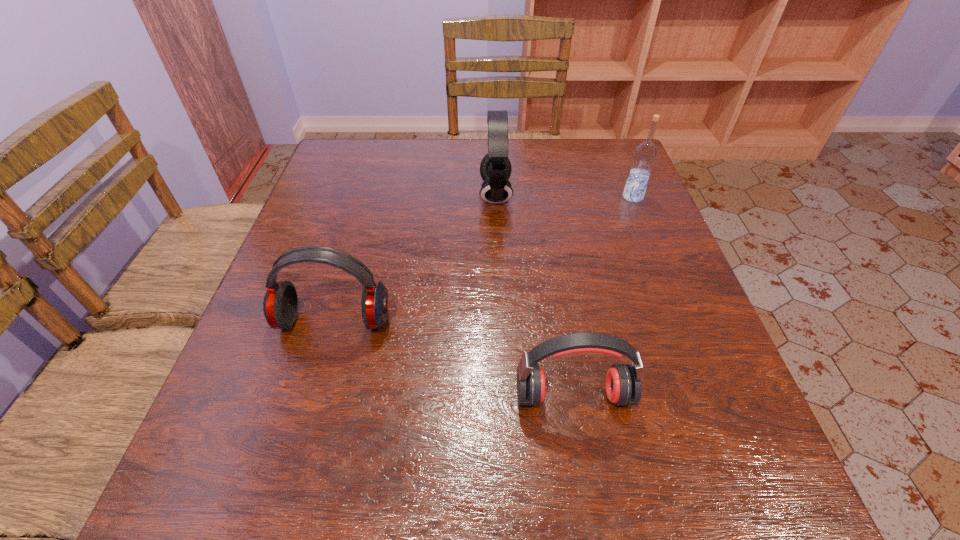
Locate an element on the screen. vacant region between the nearest object and the third farthest object is located at coordinates (454, 358).

This screenshot has width=960, height=540. In order to click on object that stands as the third closest to the tallest earphone in this screenshot , I will do `click(623, 382)`.

Identify which object is the nearest to the tallest earphone. Please provide its 2D coordinates. Your answer should be formatted as a tuple, i.e. [(x, y)], where the tuple contains the x and y coordinates of a point satisfying the conditions above.

[(645, 154)]

Where is `the closest earphone to the nearest object`? The width and height of the screenshot is (960, 540). the closest earphone to the nearest object is located at coordinates (280, 305).

Select which earphone appears as the third closest to the vodka. Please provide its 2D coordinates. Your answer should be formatted as a tuple, i.e. [(x, y)], where the tuple contains the x and y coordinates of a point satisfying the conditions above.

[(280, 305)]

Identify the location of vacant region that satisfies the following two spatial constraints: 1. on the ear cups of the tallest earphone; 2. on the ear cups of the leftmost earphone. click(x=501, y=321).

You are a GUI agent. You are given a task and a screenshot of the screen. Output one action in this format:
    pyautogui.click(x=<x>, y=<y>)
    Task: Click on the vacant space that satisfies the following two spatial constraints: 1. on the ear cups of the vodka; 2. on the right side of the tallest earphone
    
    Given the screenshot: What is the action you would take?
    pyautogui.click(x=495, y=197)

Locate an element on the screen. This screenshot has height=540, width=960. free space that satisfies the following two spatial constraints: 1. on the ear cups of the tallest earphone; 2. on the back side of the vodka is located at coordinates (495, 197).

Find the location of a particular element. The height and width of the screenshot is (540, 960). vacant space that satisfies the following two spatial constraints: 1. on the ear cups of the vodka; 2. on the left side of the farthest earphone is located at coordinates (495, 197).

This screenshot has height=540, width=960. Find the location of `vacant region that satisfies the following two spatial constraints: 1. on the ear cups of the rightmost object; 2. on the right side of the tallest earphone`. vacant region that satisfies the following two spatial constraints: 1. on the ear cups of the rightmost object; 2. on the right side of the tallest earphone is located at coordinates pos(495,197).